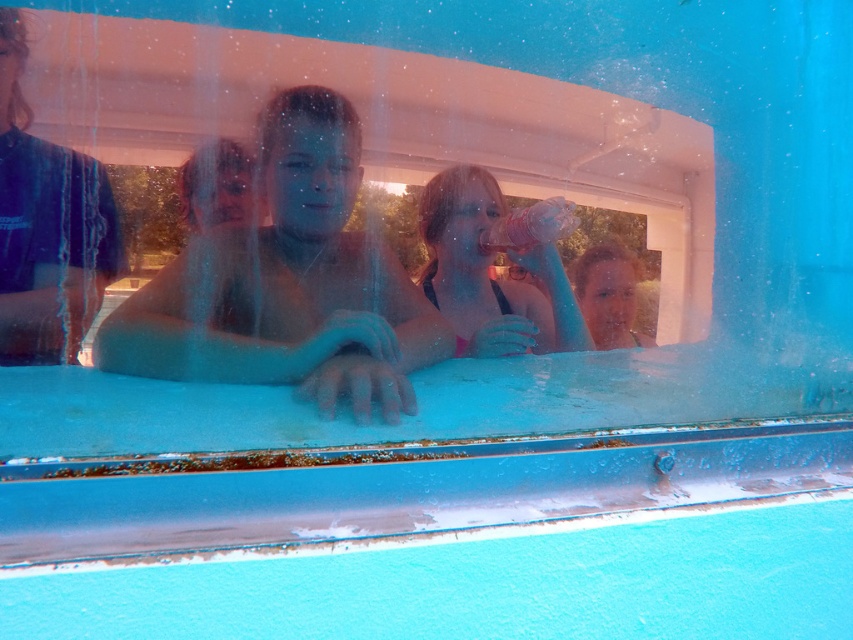
You are a photographer trying to capture a clear shot of the smooth skin boy at center and the pink fabric bikini top at center. Which object would appear larger in your photo?

The smooth skin boy at center would appear larger in the photo because it is closer to the viewer than the pink fabric bikini top at center.

You are standing in front of the poolside window with two points marked on it. The first point is at coordinates point (271,116) and the second is at point (564,337). Which point is nearer to you?

Point (271,116) is closer to the viewer than point (564,337).